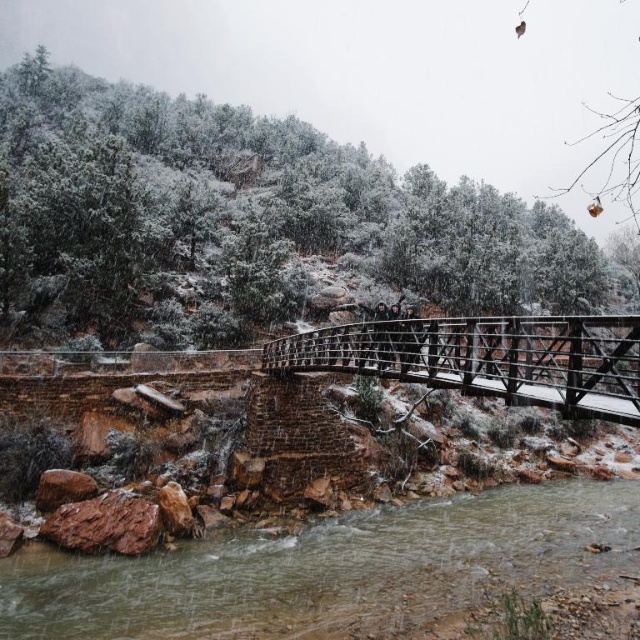
Question: Is dark brown leather jacket at center smaller than dark gray fabric jacket at center?

Choices:
 (A) no
 (B) yes

Answer: (A)

Question: Does wooden bridge at center have a greater width compared to dark brown leather jacket at center?

Choices:
 (A) yes
 (B) no

Answer: (A)

Question: Is clear water at lower left bigger than dark gray fabric jacket at center?

Choices:
 (A) yes
 (B) no

Answer: (A)

Question: Which object is closer to the camera taking this photo?

Choices:
 (A) wooden bridge at center
 (B) dark gray fabric jacket at center
 (C) clear water at lower left
 (D) dark brown leather jacket at center

Answer: (A)

Question: Which of the following is the farthest from the observer?

Choices:
 (A) wooden bridge at center
 (B) clear water at lower left
 (C) dark brown leather jacket at center

Answer: (B)

Question: Which object is closer to the camera taking this photo?

Choices:
 (A) dark brown leather jacket at center
 (B) clear water at lower left
 (C) wooden bridge at center

Answer: (C)